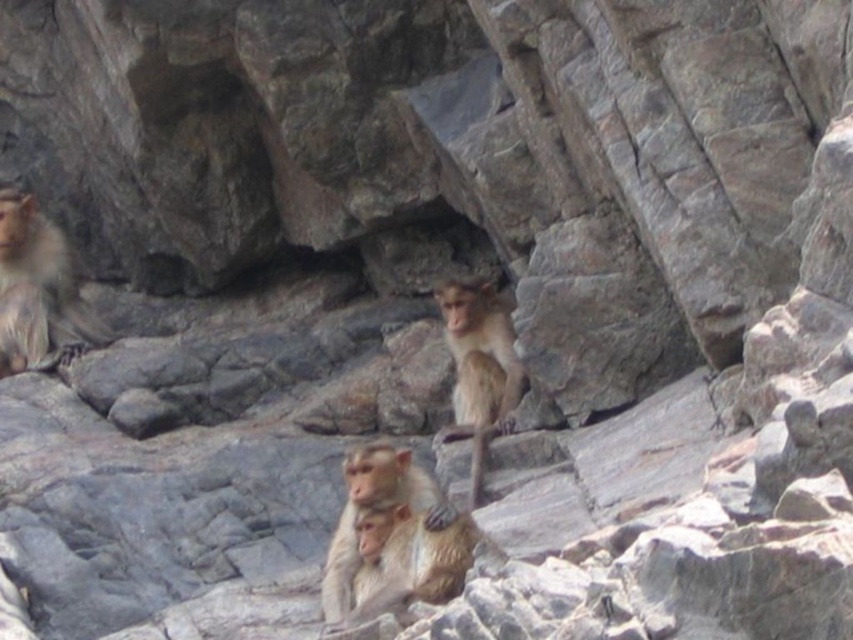
Question: Estimate the real-world distances between objects in this image. Which object is closer to the golden fur monkey at upper left?

Choices:
 (A) brown fur monkey at center
 (B) golden fur monkey at center

Answer: (A)

Question: Estimate the real-world distances between objects in this image. Which object is closer to the golden fur monkey at center?

Choices:
 (A) brown fur monkey at center
 (B) golden fur monkey at upper left

Answer: (A)

Question: Which object is farther from the camera taking this photo?

Choices:
 (A) golden fur monkey at upper left
 (B) brown fur monkey at center

Answer: (A)

Question: From the image, what is the correct spatial relationship of golden fur monkey at upper left in relation to golden fur monkey at center?

Choices:
 (A) above
 (B) below

Answer: (A)

Question: Is golden fur monkey at upper left thinner than brown fur monkey at center?

Choices:
 (A) no
 (B) yes

Answer: (A)

Question: Can you confirm if golden fur monkey at upper left is wider than light brown fur monkey at center?

Choices:
 (A) no
 (B) yes

Answer: (B)